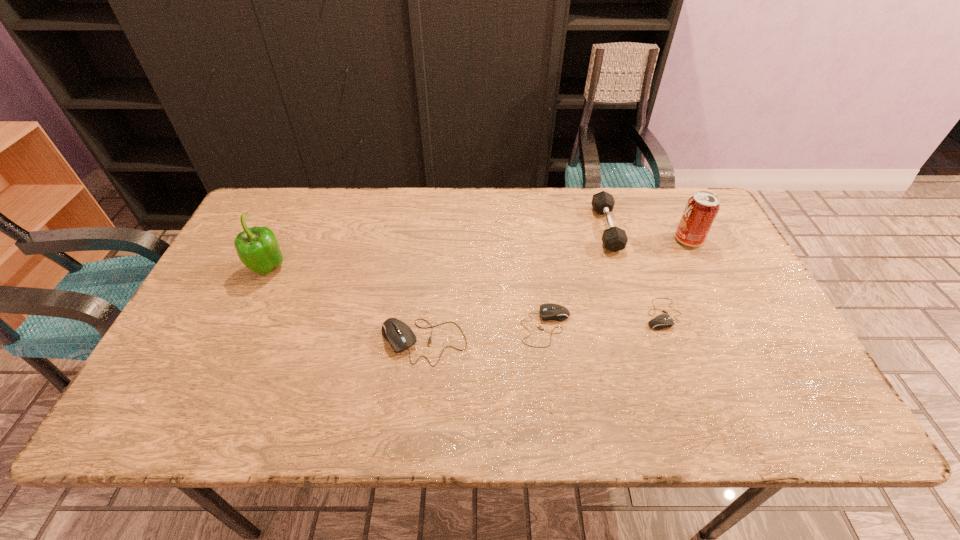
Locate an element on the screen. The height and width of the screenshot is (540, 960). the leftmost computer mouse is located at coordinates (400, 336).

Where is `the tallest computer mouse`? This screenshot has width=960, height=540. the tallest computer mouse is located at coordinates (400, 336).

At what (x,y) coordinates should I click in order to perform the action: click on the third object from left to right. Please return your answer as a coordinate pair (x, y). Looking at the image, I should click on (550, 311).

Where is `the second computer mouse from right to left`? The height and width of the screenshot is (540, 960). the second computer mouse from right to left is located at coordinates (550, 311).

Identify the location of the shortest computer mouse. The width and height of the screenshot is (960, 540). (661, 321).

Where is `the shortest object`? The image size is (960, 540). the shortest object is located at coordinates (661, 321).

The height and width of the screenshot is (540, 960). What are the coordinates of `the fourth shortest object` in the screenshot? It's located at 614,239.

Where is `the leftmost object`? The height and width of the screenshot is (540, 960). the leftmost object is located at coordinates (257, 247).

What are the coordinates of `bell pepper` in the screenshot? It's located at (257, 247).

Locate an element on the screen. The image size is (960, 540). the second tallest object is located at coordinates (700, 212).